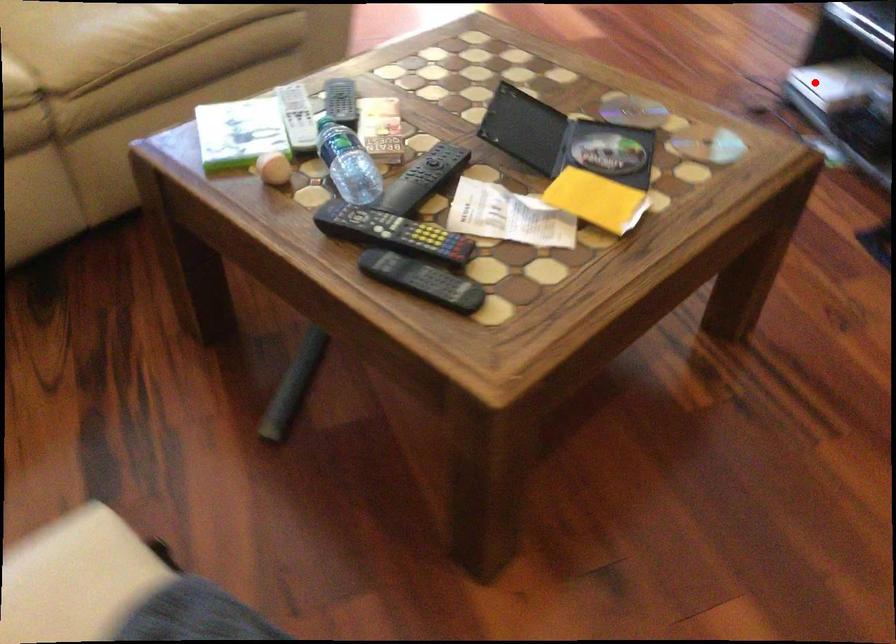
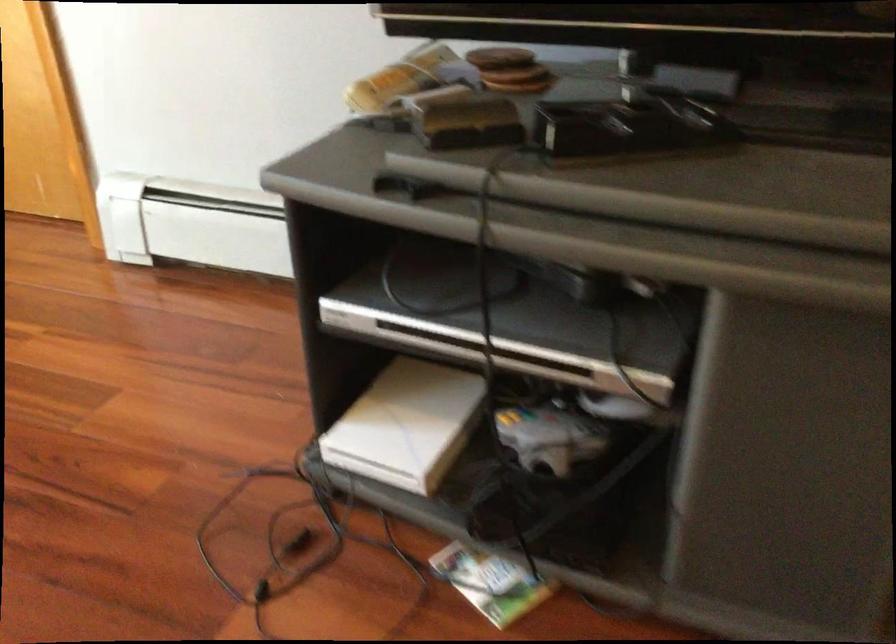
Find the pixel in the second image that matches the highlighted location in the first image.

(407, 424)